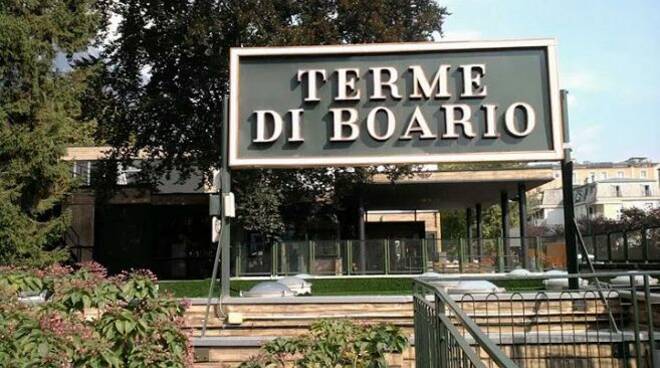
Locate an element on the screen. Image resolution: width=660 pixels, height=368 pixels. plant in bottom center is located at coordinates (267, 358), (292, 344), (350, 333), (414, 341), (374, 355), (337, 322).